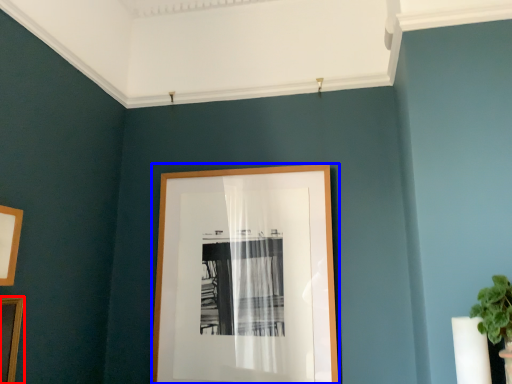
Question: Which object is further to the camera taking this photo, picture frame (highlighted by a red box) or picture frame (highlighted by a blue box)?

Choices:
 (A) picture frame
 (B) picture frame

Answer: (B)